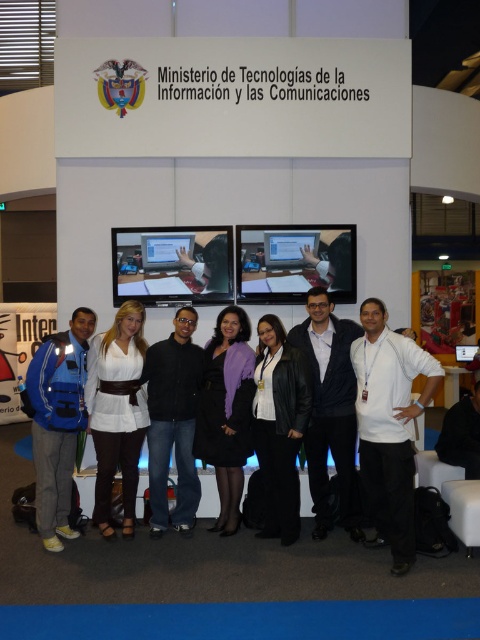
Question: Which point is closer to the camera?

Choices:
 (A) white matte shirt at right
 (B) white matte shirt at center
 (C) purple matte jacket at center

Answer: (A)

Question: Is white matte shirt at center further to the viewer compared to black matte shirt at center?

Choices:
 (A) no
 (B) yes

Answer: (A)

Question: Among these points, which one is farthest from the camera?

Choices:
 (A) (123, 486)
 (B) (225, 445)
 (C) (48, 445)
 (D) (282, 424)

Answer: (A)

Question: Can you confirm if blue fabric backpack at left is positioned to the right of black matte shirt at center?

Choices:
 (A) yes
 (B) no

Answer: (B)

Question: Does white matte shirt at right appear over black leather jacket at center?

Choices:
 (A) no
 (B) yes

Answer: (B)

Question: Which object is closer to the camera taking this photo?

Choices:
 (A) black leather jacket at center
 (B) white matte shirt at right
 (C) blue fabric backpack at left
 (D) purple matte jacket at center

Answer: (B)